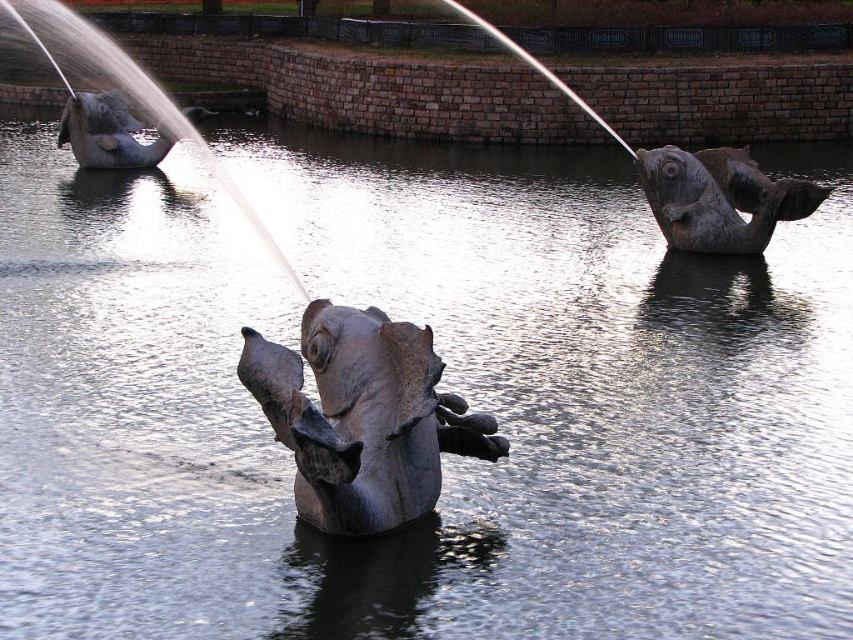
Question: Does rusty metal fish at right have a greater width compared to gray stone elephant at left?

Choices:
 (A) no
 (B) yes

Answer: (A)

Question: Which point appears farthest from the camera in this image?

Choices:
 (A) (200, 109)
 (B) (746, 225)
 (C) (401, 456)

Answer: (A)

Question: Does matte gray elephant at center have a lesser width compared to gray stone elephant at left?

Choices:
 (A) no
 (B) yes

Answer: (B)

Question: Which object appears farthest from the camera in this image?

Choices:
 (A) matte gray elephant at center
 (B) gray stone elephant at left

Answer: (B)

Question: Does matte gray elephant at center have a lesser width compared to rusty metal fish at right?

Choices:
 (A) no
 (B) yes

Answer: (B)

Question: Which of the following is the closest to the observer?

Choices:
 (A) (106, 99)
 (B) (773, 220)

Answer: (B)